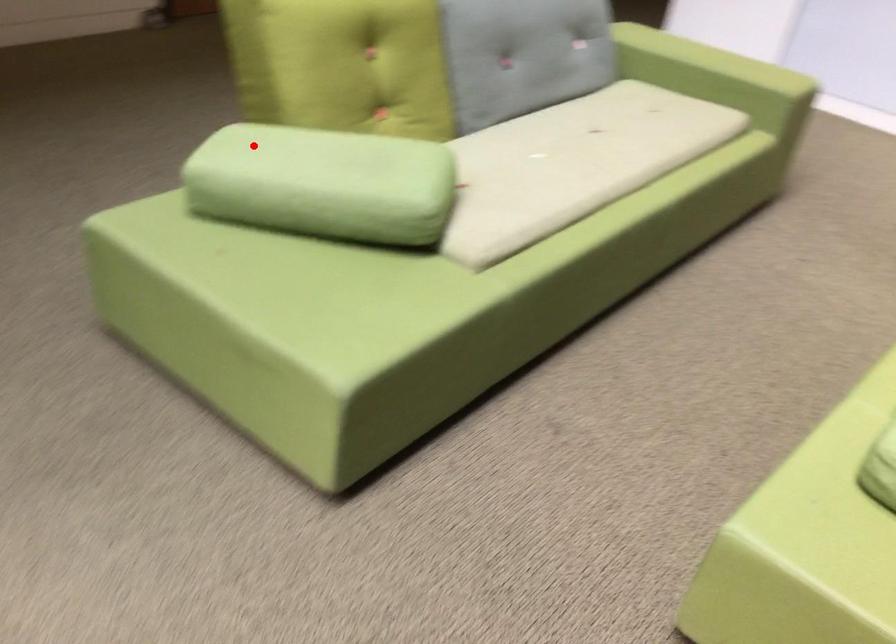
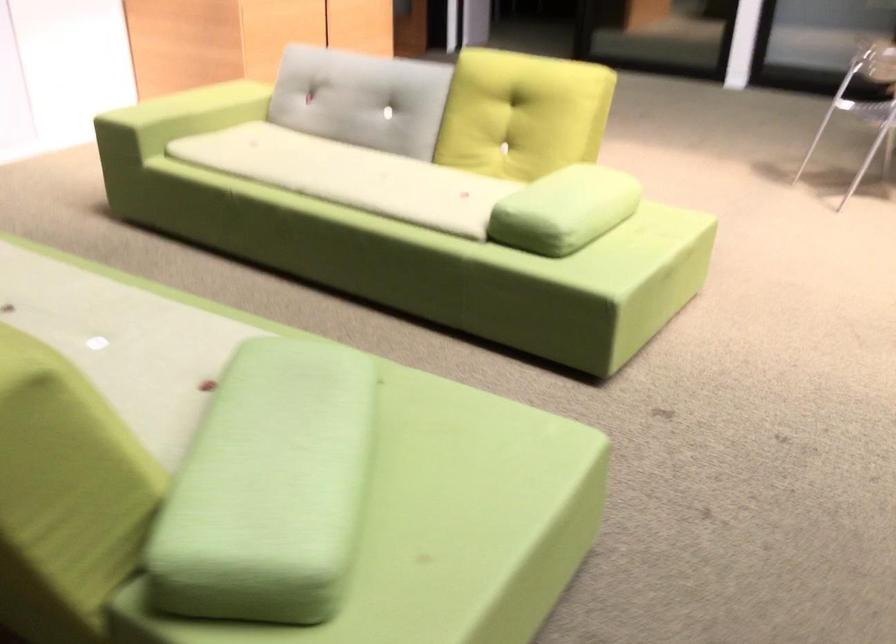
Question: I am providing you with two images of the same scene from different viewpoints. Given a red point in image1, look at the same physical point in image2. Is it:

Choices:
 (A) Closer to the viewpoint
 (B) Farther from the viewpoint

Answer: (A)